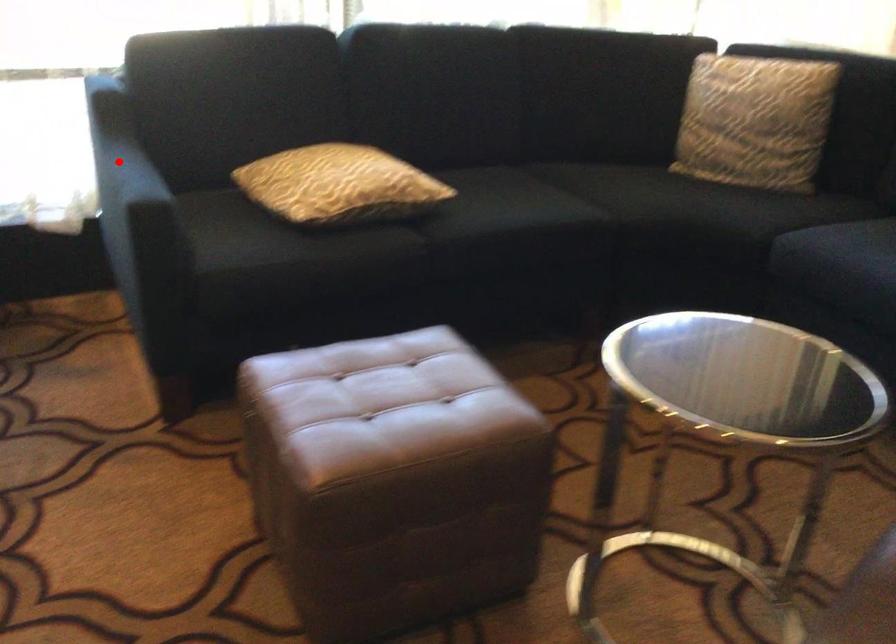
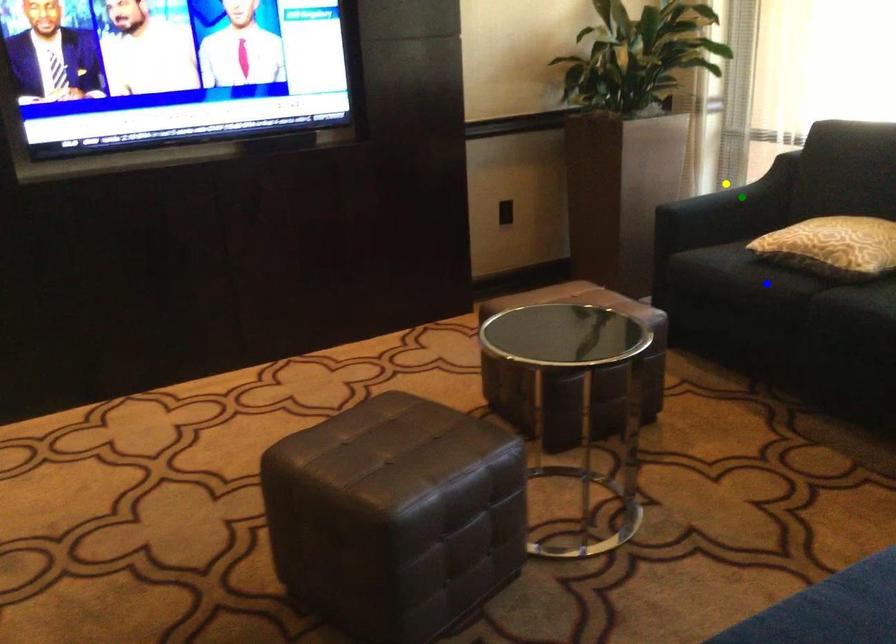
Question: I am providing you with two images of the same scene from different viewpoints. A red point is marked on the first image. You are given multiple points on the second image. Can you choose the point in image 2 that corresponds to the point in image 1?

Choices:
 (A) green point
 (B) yellow point
 (C) blue point

Answer: (B)